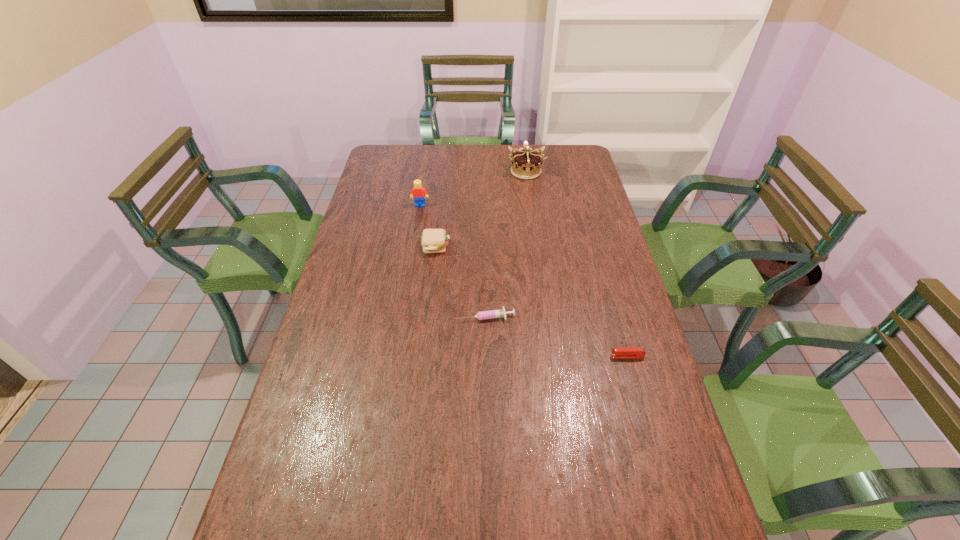
At what (x,y) coordinates should I click in order to perform the action: click on vacant area at the right edge. Please return your answer as a coordinate pair (x, y). Looking at the image, I should click on (655, 392).

You are a GUI agent. You are given a task and a screenshot of the screen. Output one action in this format:
    pyautogui.click(x=<x>, y=<y>)
    Task: Click on the vacant space at the far left corner of the desktop
    
    Given the screenshot: What is the action you would take?
    pyautogui.click(x=380, y=161)

In order to click on vacant point at the far right corner in this screenshot , I will do `click(562, 150)`.

Locate an element on the screen. vacant area that lies between the nearest object and the Lego is located at coordinates (523, 281).

The height and width of the screenshot is (540, 960). In order to click on unoccupied position between the patty and the farthest object in this screenshot , I will do `click(481, 209)`.

Where is `vacant region between the farthest object and the third nearest object`? vacant region between the farthest object and the third nearest object is located at coordinates pos(481,209).

Identify the location of free space between the crown and the syringe. (505, 244).

This screenshot has height=540, width=960. I want to click on vacant area between the third shortest object and the farthest object, so click(481, 209).

At what (x,y) coordinates should I click in order to perform the action: click on free space that is in between the patty and the fourth nearest object. Please return your answer as a coordinate pair (x, y). The image size is (960, 540). Looking at the image, I should click on (428, 226).

Locate an element on the screen. The height and width of the screenshot is (540, 960). free space between the second farthest object and the syringe is located at coordinates (452, 261).